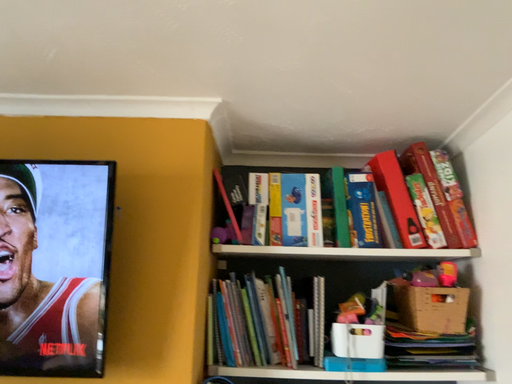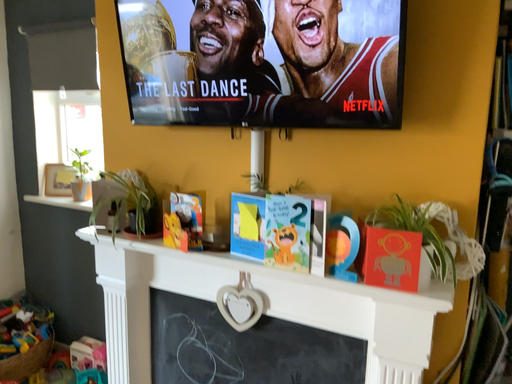
Question: How did the camera likely rotate when shooting the video?

Choices:
 (A) rotated upward
 (B) rotated downward

Answer: (B)